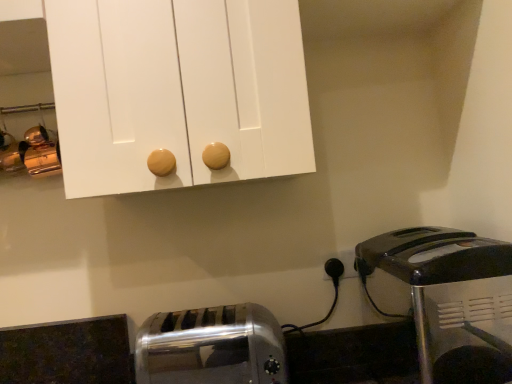
What do you see at coordinates (211, 347) in the screenshot? I see `satin silver toaster at lower left, which appears as the first toaster when viewed from the left` at bounding box center [211, 347].

I want to click on satin silver toaster at lower left, which appears as the first toaster when viewed from the left, so pyautogui.click(x=211, y=347).

Measure the distance between satin silver toaster at lower left, which appears as the first toaster when viewed from the left, and camera.

satin silver toaster at lower left, which appears as the first toaster when viewed from the left, and camera are 35.54 inches apart.

Identify the location of black plastic toaster at lower right, the second toaster from the left. Image resolution: width=512 pixels, height=384 pixels. (445, 298).

What is the approximate height of black plastic toaster at lower right, arranged as the first toaster when viewed from the right?

black plastic toaster at lower right, arranged as the first toaster when viewed from the right, is 14.02 inches in height.

What do you see at coordinates (445, 298) in the screenshot? I see `black plastic toaster at lower right, the second toaster from the left` at bounding box center [445, 298].

The image size is (512, 384). What are the coordinates of `satin silver toaster at lower left, which appears as the first toaster when viewed from the left` in the screenshot? It's located at (211, 347).

Can you confirm if satin silver toaster at lower left, which appears as the first toaster when viewed from the left, is positioned to the right of black plastic toaster at lower right, the second toaster from the left?

No, satin silver toaster at lower left, which appears as the first toaster when viewed from the left, is not to the right of black plastic toaster at lower right, the second toaster from the left.

Which is behind, satin silver toaster at lower left, the second toaster in the right-to-left sequence, or black plastic toaster at lower right, the second toaster from the left?

satin silver toaster at lower left, the second toaster in the right-to-left sequence, is behind.

Does point (201, 374) appear closer or farther from the camera than point (471, 256)?

Point (201, 374) appears to be farther away from the viewer than point (471, 256).

From the image's perspective, which is below, satin silver toaster at lower left, which appears as the first toaster when viewed from the left, or black plastic toaster at lower right, the second toaster from the left?

satin silver toaster at lower left, which appears as the first toaster when viewed from the left, is shown below in the image.

From a real-world perspective, who is located higher, satin silver toaster at lower left, which appears as the first toaster when viewed from the left, or black plastic toaster at lower right, arranged as the first toaster when viewed from the right?

black plastic toaster at lower right, arranged as the first toaster when viewed from the right, from a real-world perspective.

Can you confirm if satin silver toaster at lower left, which appears as the first toaster when viewed from the left, is thinner than black plastic toaster at lower right, the second toaster from the left?

Yes.

Based on the photo, which of these two, satin silver toaster at lower left, which appears as the first toaster when viewed from the left, or black plastic toaster at lower right, arranged as the first toaster when viewed from the right, stands taller?

Standing taller between the two is black plastic toaster at lower right, arranged as the first toaster when viewed from the right.

Is satin silver toaster at lower left, the second toaster in the right-to-left sequence, bigger or smaller than black plastic toaster at lower right, arranged as the first toaster when viewed from the right?

In the image, satin silver toaster at lower left, the second toaster in the right-to-left sequence, appears to be smaller than black plastic toaster at lower right, arranged as the first toaster when viewed from the right.

Do you think satin silver toaster at lower left, which appears as the first toaster when viewed from the left, is within black plastic toaster at lower right, the second toaster from the left, or outside of it?

satin silver toaster at lower left, which appears as the first toaster when viewed from the left, is outside black plastic toaster at lower right, the second toaster from the left.

Is satin silver toaster at lower left, the second toaster in the right-to-left sequence, with black plastic toaster at lower right, the second toaster from the left?

satin silver toaster at lower left, the second toaster in the right-to-left sequence, is not next to black plastic toaster at lower right, the second toaster from the left, and they're not touching.

Is satin silver toaster at lower left, which appears as the first toaster when viewed from the left, turned away from black plastic toaster at lower right, arranged as the first toaster when viewed from the right?

No, satin silver toaster at lower left, which appears as the first toaster when viewed from the left,'s orientation is not away from black plastic toaster at lower right, arranged as the first toaster when viewed from the right.

Identify the location of toaster that is above the satin silver toaster at lower left, the second toaster in the right-to-left sequence (from the image's perspective). (445, 298).

Between black plastic toaster at lower right, arranged as the first toaster when viewed from the right, and satin silver toaster at lower left, which appears as the first toaster when viewed from the left, which one appears on the right side from the viewer's perspective?

black plastic toaster at lower right, arranged as the first toaster when viewed from the right.

Does black plastic toaster at lower right, the second toaster from the left, come behind satin silver toaster at lower left, the second toaster in the right-to-left sequence?

No, it is in front of satin silver toaster at lower left, the second toaster in the right-to-left sequence.

Which is in front, point (444, 335) or point (185, 320)?

Point (444, 335)

From the image's perspective, is black plastic toaster at lower right, the second toaster from the left, above satin silver toaster at lower left, which appears as the first toaster when viewed from the left?

Yes.

From a real-world perspective, is black plastic toaster at lower right, the second toaster from the left, under satin silver toaster at lower left, which appears as the first toaster when viewed from the left?

Actually, black plastic toaster at lower right, the second toaster from the left, is physically above satin silver toaster at lower left, which appears as the first toaster when viewed from the left, in the real world.

Considering the sizes of black plastic toaster at lower right, the second toaster from the left, and satin silver toaster at lower left, which appears as the first toaster when viewed from the left, in the image, is black plastic toaster at lower right, the second toaster from the left, wider or thinner than satin silver toaster at lower left, which appears as the first toaster when viewed from the left,?

Considering their sizes, black plastic toaster at lower right, the second toaster from the left, looks broader than satin silver toaster at lower left, which appears as the first toaster when viewed from the left.

Is black plastic toaster at lower right, the second toaster from the left, taller or shorter than satin silver toaster at lower left, which appears as the first toaster when viewed from the left?

Considering their sizes, black plastic toaster at lower right, the second toaster from the left, has more height than satin silver toaster at lower left, which appears as the first toaster when viewed from the left.

Between black plastic toaster at lower right, the second toaster from the left, and satin silver toaster at lower left, which appears as the first toaster when viewed from the left, which one has larger size?

black plastic toaster at lower right, the second toaster from the left, is bigger.

Do you think black plastic toaster at lower right, the second toaster from the left, is within satin silver toaster at lower left, the second toaster in the right-to-left sequence, or outside of it?

black plastic toaster at lower right, the second toaster from the left, lies outside satin silver toaster at lower left, the second toaster in the right-to-left sequence.

Is there a large distance between black plastic toaster at lower right, the second toaster from the left, and satin silver toaster at lower left, the second toaster in the right-to-left sequence?

black plastic toaster at lower right, the second toaster from the left, is near satin silver toaster at lower left, the second toaster in the right-to-left sequence, not far away.

Is black plastic toaster at lower right, arranged as the first toaster when viewed from the right, turned away from satin silver toaster at lower left, the second toaster in the right-to-left sequence?

No, satin silver toaster at lower left, the second toaster in the right-to-left sequence, is not at the back of black plastic toaster at lower right, arranged as the first toaster when viewed from the right.

Where is `toaster above the satin silver toaster at lower left, the second toaster in the right-to-left sequence (from the image's perspective)`? The width and height of the screenshot is (512, 384). toaster above the satin silver toaster at lower left, the second toaster in the right-to-left sequence (from the image's perspective) is located at coordinates (445, 298).

This screenshot has width=512, height=384. Identify the location of toaster located above the satin silver toaster at lower left, the second toaster in the right-to-left sequence (from the image's perspective). (445, 298).

Locate an element on the screen. toaster below the black plastic toaster at lower right, the second toaster from the left (from a real-world perspective) is located at coordinates (211, 347).